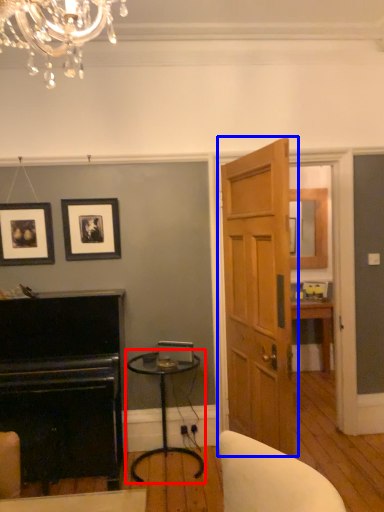
Question: Which point is further to the camera, table (highlighted by a red box) or door (highlighted by a blue box)?

Choices:
 (A) table
 (B) door

Answer: (A)